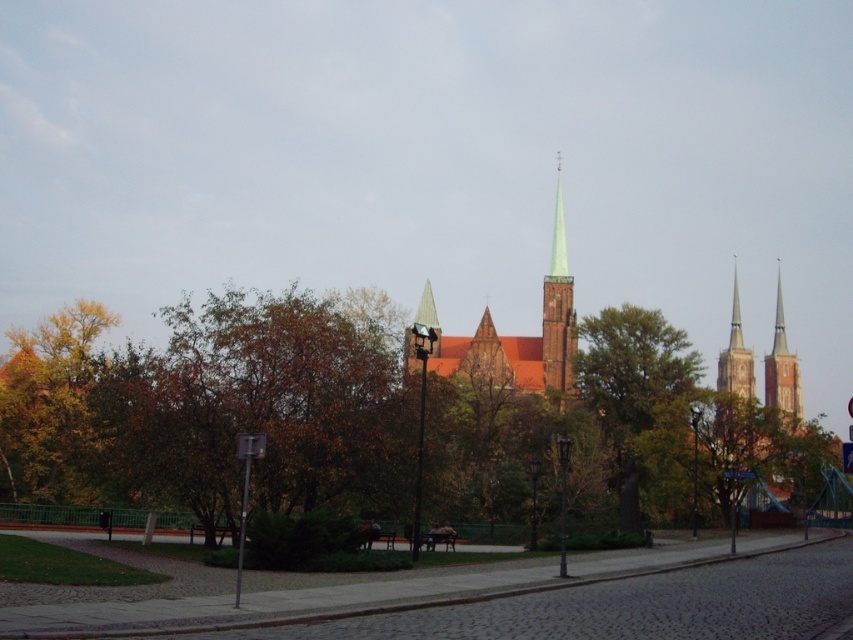
You are standing at the point marked as point (631,388) in the image. What object is located exactly at that point?

The green leafy tree at center is located exactly at point (631,388).

You are standing in the foreground of the scene, near the cobblestone paths. You want to walk towards the church spires. Which of the two points, point (x=628, y=486) or point (x=556, y=252), will you reach first?

Point (x=628, y=486) is closer to the viewer than point (x=556, y=252), so you will reach point (x=628, y=486) first.

You are a tourist standing in front of the historic church. You notice a green leafy tree at center and a green glass spire at center. Which object is closer to you?

The green leafy tree at center is closer to you because it is in front of the green glass spire at center.